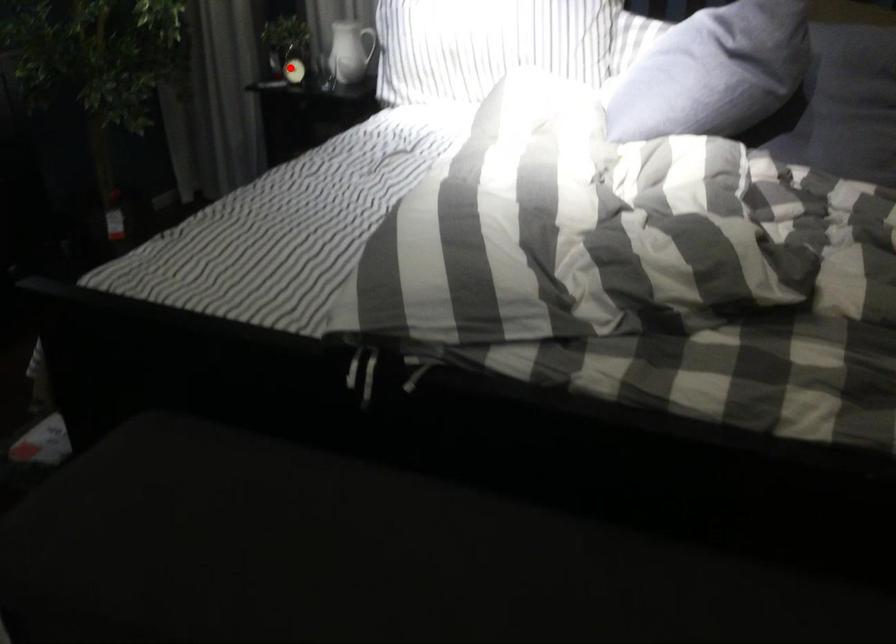
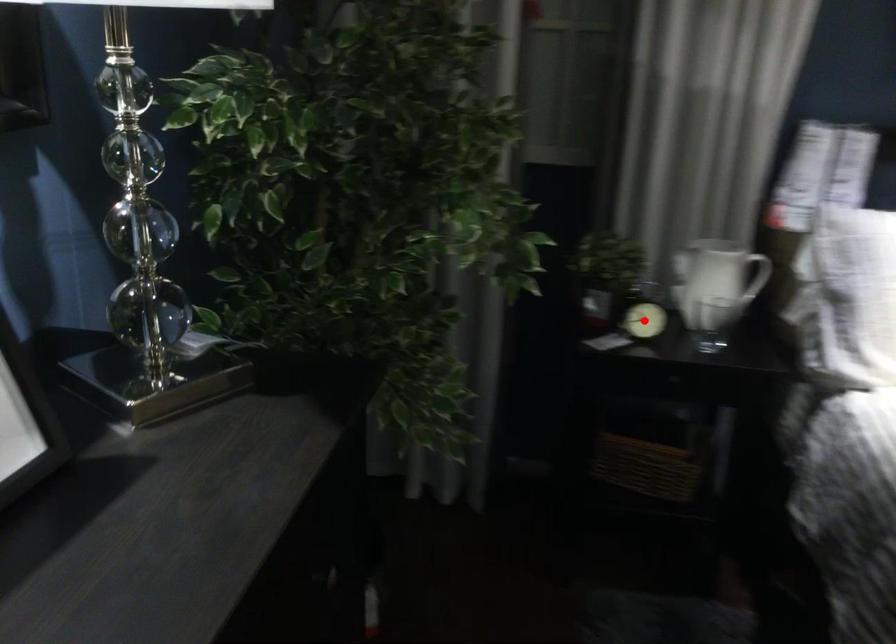
I am providing you with two images of the same scene from different viewpoints. A red point is marked on the first image and another point is marked on the second image. Is the marked point in image1 the same physical position as the marked point in image2?

Yes